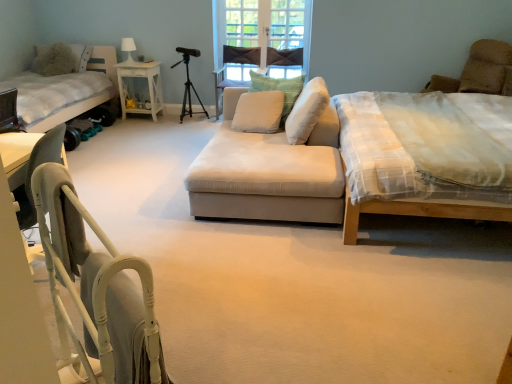
Image resolution: width=512 pixels, height=384 pixels. Find the location of `unoccupied area in front of beige fabric couch at center`. unoccupied area in front of beige fabric couch at center is located at coordinates (281, 276).